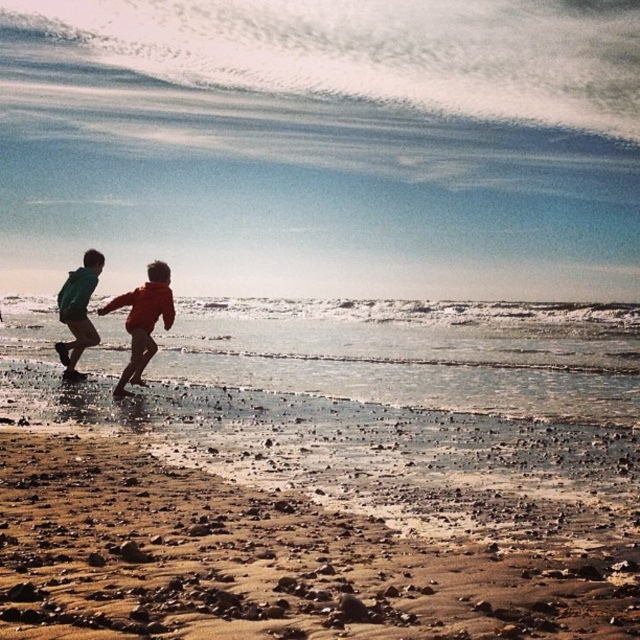
Who is positioned more to the left, brown sandy beach at lower left or orange fabric child at center?

From the viewer's perspective, orange fabric child at center appears more on the left side.

Between point (67, 477) and point (132, 324), which one is positioned behind?

Positioned behind is point (132, 324).

Does point (417, 541) come in front of point (131, 358)?

Yes, it is.

Locate an element on the screen. brown sandy beach at lower left is located at coordinates (256, 563).

From the picture: Which of these two, brown sandy beach at lower left or green matte jacket at left, stands shorter?

Standing shorter between the two is brown sandy beach at lower left.

Can you confirm if brown sandy beach at lower left is positioned below green matte jacket at left?

Yes, brown sandy beach at lower left is below green matte jacket at left.

Image resolution: width=640 pixels, height=640 pixels. Describe the element at coordinates (256, 563) in the screenshot. I see `brown sandy beach at lower left` at that location.

At what (x,y) coordinates should I click in order to perform the action: click on brown sandy beach at lower left. Please return your answer as a coordinate pair (x, y). The width and height of the screenshot is (640, 640). Looking at the image, I should click on (x=256, y=563).

Is point (113, 308) positioned after point (86, 296)?

No, (113, 308) is closer to viewer.

Can you confirm if orange fabric child at center is shorter than green matte jacket at left?

In fact, orange fabric child at center may be taller than green matte jacket at left.

Locate an element on the screen. The width and height of the screenshot is (640, 640). orange fabric child at center is located at coordinates (144, 321).